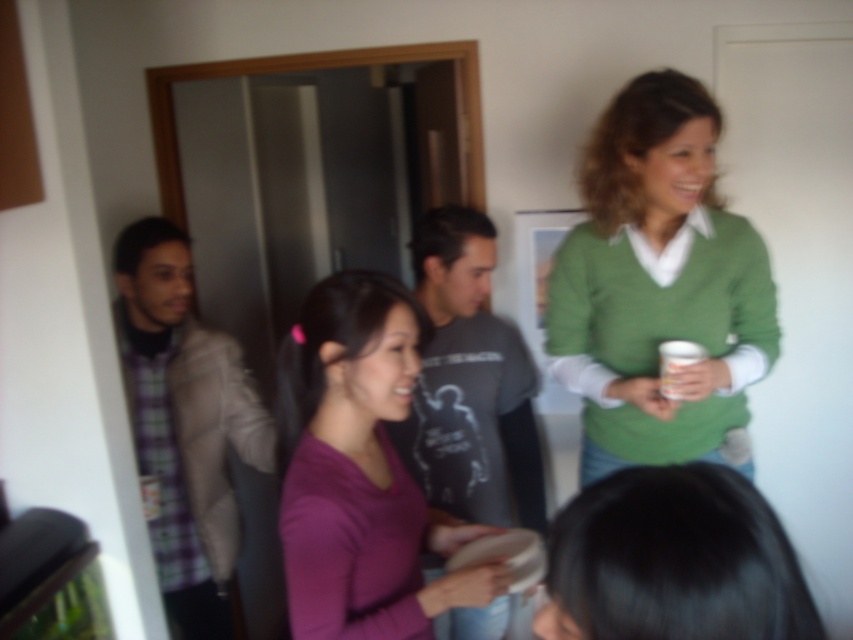
You are a photographer setting up for a group photo. You want to ensure that both the green matte sweater at upper right and the plaid fabric shirt at left are visible in the frame. Based on their positions, which one is closer to the camera?

The green matte sweater at upper right is in front of the plaid fabric shirt at left, so it is closer to the camera.

Looking at this image, you are a photographer trying to capture a group photo. You notice two elements in the frame that might affect the composition. The black hair at lower center and the plaid fabric shirt at left. Which of these two elements is shorter in height?

The black hair at lower center is not as tall as the plaid fabric shirt at left, so the black hair at lower center is shorter in height.

From the picture: You are a photographer setting up for a group photo. You notice two people in the scene, the person with black hair at lower center and the one in plaid fabric shirt at left. From the photographer perspective facing the group, which person is positioned more to your right side?

The black hair at lower center is positioned to the right of plaid fabric shirt at left, so from the photographer perspective facing the group, the person with black hair at lower center is more to the right side.